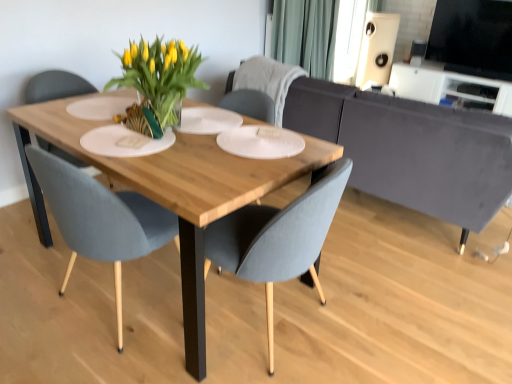
Where is `vacant area to the right of matte gray chair at center, the 3th chair when ordered from back to front`? The height and width of the screenshot is (384, 512). vacant area to the right of matte gray chair at center, the 3th chair when ordered from back to front is located at coordinates (370, 322).